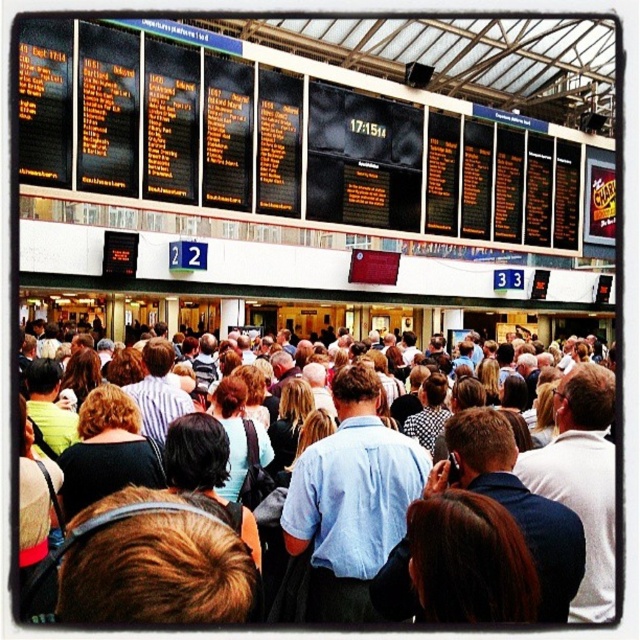
Is point (570, 176) positioned before point (568, 572)?

No, it is not.

Which is behind, point (148, 115) or point (580, 568)?

The point (148, 115) is more distant.

Does point (280, 138) lie in front of point (330, 577)?

That is False.

Locate an element on the screen. black digital display at upper center is located at coordinates (330, 122).